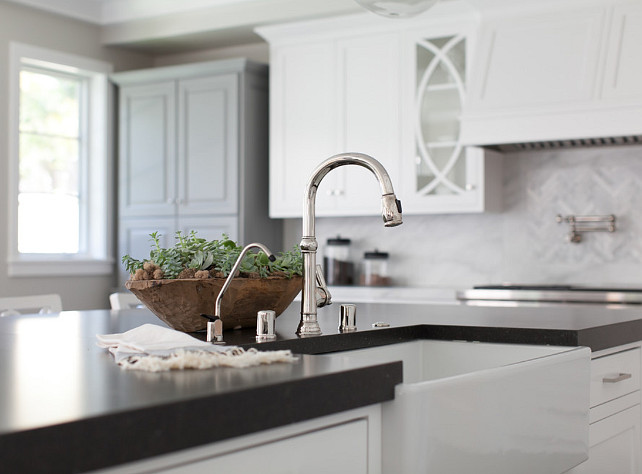
Find the location of `drawer handle`. drawer handle is located at coordinates (610, 381).